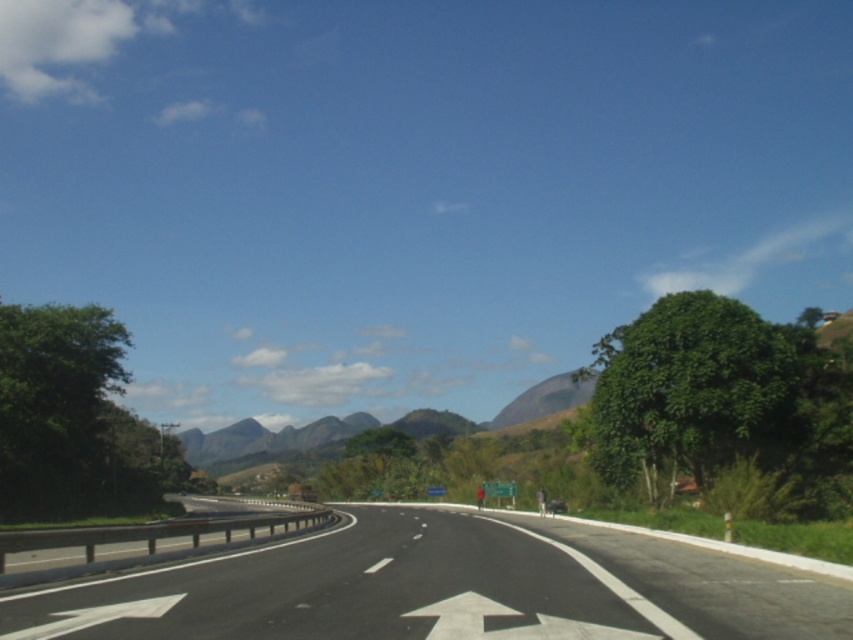
Question: Can you confirm if black asphalt road at center is thinner than white glossy arrow at center?

Choices:
 (A) no
 (B) yes

Answer: (A)

Question: Which point appears farthest from the camera in this image?

Choices:
 (A) (583, 556)
 (B) (517, 625)

Answer: (A)

Question: Does black asphalt road at center have a larger size compared to white glossy arrow at center?

Choices:
 (A) no
 (B) yes

Answer: (B)

Question: From the image, what is the correct spatial relationship of black asphalt road at center in relation to white glossy arrow at center?

Choices:
 (A) right
 (B) left

Answer: (A)

Question: Which of the following is the farthest from the observer?

Choices:
 (A) (108, 628)
 (B) (498, 634)

Answer: (A)